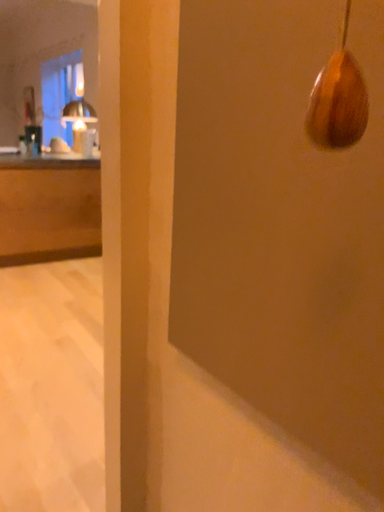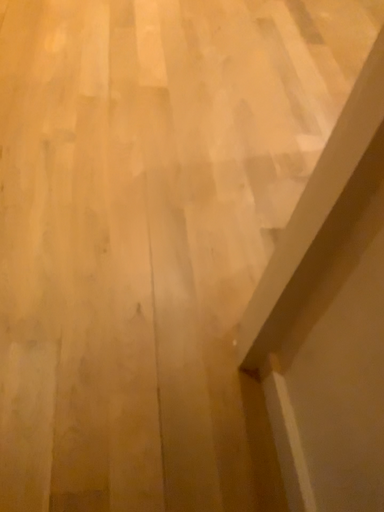
Question: How did the camera likely rotate when shooting the video?

Choices:
 (A) rotated upward
 (B) rotated downward

Answer: (B)